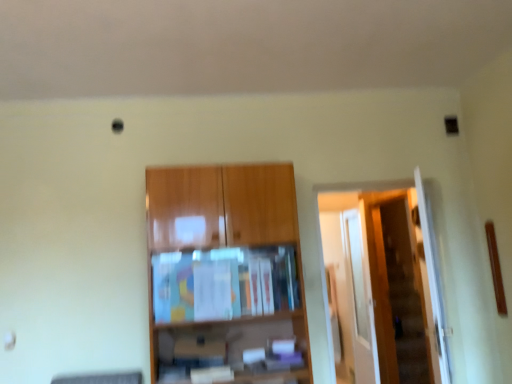
Question: Considering the relative positions of wooden cabinet at center and transparent glass door at right in the image provided, is wooden cabinet at center to the left or to the right of transparent glass door at right?

Choices:
 (A) right
 (B) left

Answer: (B)

Question: Considering the positions of wooden cabinet at center and transparent glass door at right in the image, is wooden cabinet at center wider or thinner than transparent glass door at right?

Choices:
 (A) wide
 (B) thin

Answer: (A)

Question: Estimate the real-world distances between objects in this image. Which object is closer to the wooden cabinet at center?

Choices:
 (A) wooden door at right
 (B) transparent glass door at right

Answer: (A)

Question: Which is farther from the wooden cabinet at center?

Choices:
 (A) transparent glass door at right
 (B) wooden door at right

Answer: (A)